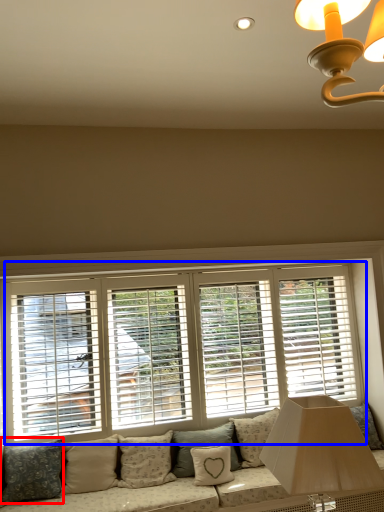
Question: Among these objects, which one is farthest to the camera, pillow (highlighted by a red box) or window (highlighted by a blue box)?

Choices:
 (A) pillow
 (B) window

Answer: (B)